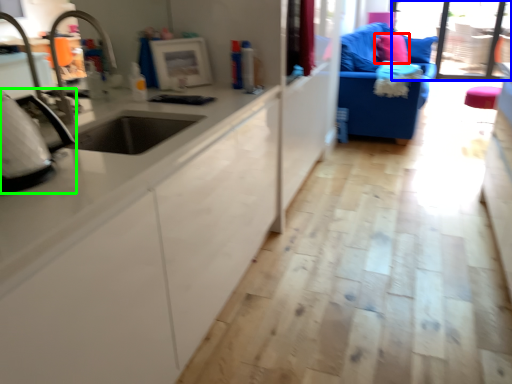
Question: Estimate the real-world distances between objects in this image. Which object is farther from pillow (highlighted by a red box), window screen (highlighted by a blue box) or appliance (highlighted by a green box)?

Choices:
 (A) window screen
 (B) appliance

Answer: (B)